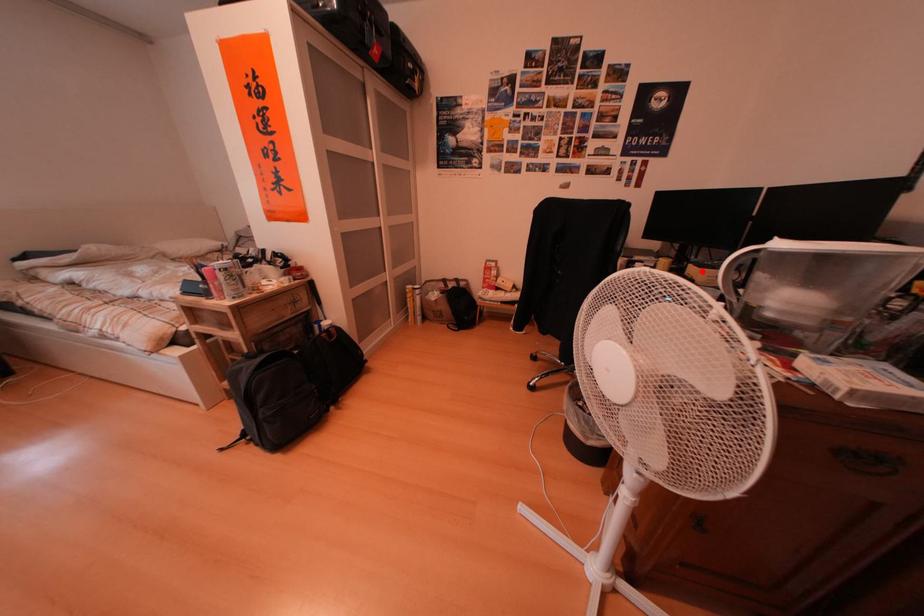
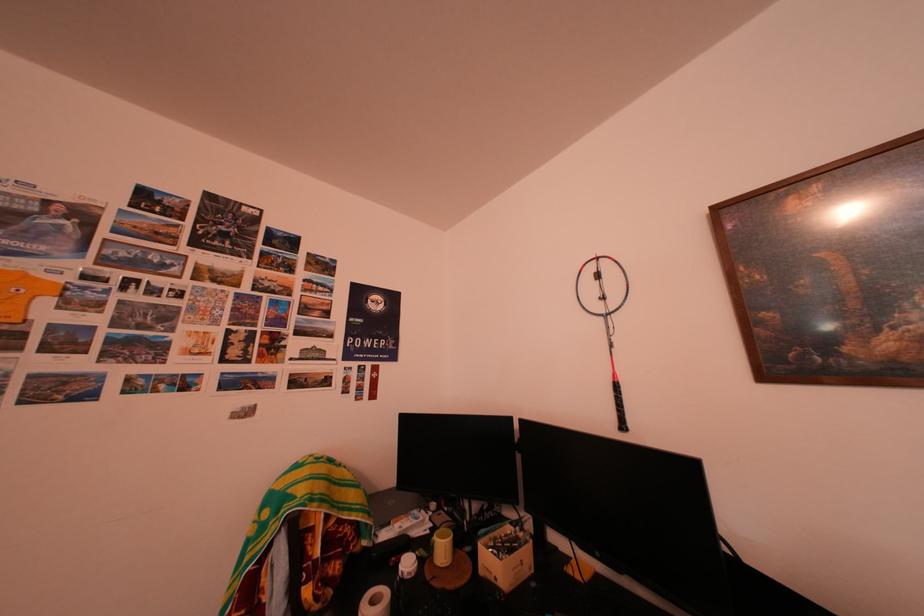
In the second image, find the point that corresponds to the highlighted location in the first image.

(493, 552)